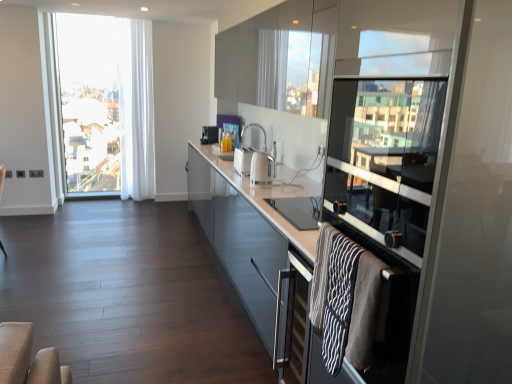
Based on the photo, measure the distance between transparent glass screen door at right and camera.

The depth of transparent glass screen door at right is 35.72 inches.

This screenshot has height=384, width=512. I want to click on white glossy toaster at center, marked as the second appliance in a back-to-front arrangement, so click(x=243, y=160).

What do you see at coordinates (243, 160) in the screenshot? I see `white glossy toaster at center, the second appliance when ordered from bottom to top` at bounding box center [243, 160].

This screenshot has width=512, height=384. What do you see at coordinates (106, 103) in the screenshot? I see `clear glass window at left` at bounding box center [106, 103].

The height and width of the screenshot is (384, 512). I want to click on transparent glass window screen at right, so click(x=385, y=157).

Who is smaller, glossy glass cabinet at center, positioned as the 1th cabinetry in bottom-to-top order, or glossy glass cabinets at upper center, the 1th cabinetry viewed from the top?

With smaller size is glossy glass cabinets at upper center, the 1th cabinetry viewed from the top.

Which is more to the right, glossy glass cabinet at center, the second cabinetry from the top, or glossy glass cabinets at upper center, the 1th cabinetry viewed from the top?

glossy glass cabinets at upper center, the 1th cabinetry viewed from the top, is more to the right.

From the image's perspective, does glossy glass cabinet at center, positioned as the 1th cabinetry in bottom-to-top order, appear higher than glossy glass cabinets at upper center, the 1th cabinetry viewed from the top?

No, from the image's perspective, glossy glass cabinet at center, positioned as the 1th cabinetry in bottom-to-top order, is not above glossy glass cabinets at upper center, the 1th cabinetry viewed from the top.

Is glossy glass cabinet at center, the second cabinetry from the top, aimed at glossy glass cabinets at upper center, the 1th cabinetry viewed from the top?

No.

Identify the location of appliance that is the 3rd one when counting forward from the clear glass window at left. (262, 169).

Which object is further away from the camera taking this photo, clear glass window at left or white glossy electric kettle at center, placed as the 1th appliance when sorted from bottom to top?

clear glass window at left is further from the camera.

In the scene shown: Which of these two, clear glass window at left or white glossy electric kettle at center, the 1th appliance from the front, is wider?

With larger width is clear glass window at left.

Is clear glass window at left facing away from white glossy electric kettle at center, arranged as the 3th appliance when viewed from the top?

No, clear glass window at left is not facing the opposite direction of white glossy electric kettle at center, arranged as the 3th appliance when viewed from the top.

Does point (104, 27) come behind point (240, 163)?

Yes, point (104, 27) is farther from viewer.

Measure the distance between clear glass window at left and white glossy toaster at center, marked as the second appliance in a back-to-front arrangement.

A distance of 8.05 feet exists between clear glass window at left and white glossy toaster at center, marked as the second appliance in a back-to-front arrangement.

From the image's perspective, which is below, clear glass window at left or white glossy toaster at center, placed as the 2th appliance when sorted from top to bottom?

white glossy toaster at center, placed as the 2th appliance when sorted from top to bottom, is shown below in the image.

From a real-world perspective, is clear glass window at left above or below white glossy toaster at center, marked as the second appliance in a left-to-right arrangement?

clear glass window at left is situated higher than white glossy toaster at center, marked as the second appliance in a left-to-right arrangement, in the real world.

Considering the relative positions of white glossy electric kettle at center, arranged as the 3th appliance when viewed from the top, and transparent glass window screen at right in the image provided, is white glossy electric kettle at center, arranged as the 3th appliance when viewed from the top, to the left of transparent glass window screen at right from the viewer's perspective?

Yes, white glossy electric kettle at center, arranged as the 3th appliance when viewed from the top, is to the left of transparent glass window screen at right.

From the image's perspective, which one is positioned lower, white glossy electric kettle at center, arranged as the 3th appliance when viewed from the top, or transparent glass window screen at right?

white glossy electric kettle at center, arranged as the 3th appliance when viewed from the top, is shown below in the image.

Which is closer to the camera, [260,161] or [340,102]?

Positioned in front is point [340,102].

Is white glossy electric kettle at center, arranged as the 3th appliance when viewed from the top, positioned with its back to transparent glass window screen at right?

That's not correct — white glossy electric kettle at center, arranged as the 3th appliance when viewed from the top, is not looking away from transparent glass window screen at right.

Is white glossy toaster at center, marked as the second appliance in a back-to-front arrangement, wider than glossy glass cabinets at upper center, the 1th cabinetry viewed from the top?

In fact, white glossy toaster at center, marked as the second appliance in a back-to-front arrangement, might be narrower than glossy glass cabinets at upper center, the 1th cabinetry viewed from the top.

From a real-world perspective, is white glossy toaster at center, placed as the 2th appliance when sorted from top to bottom, above or below glossy glass cabinets at upper center, the 1th cabinetry viewed from the top?

In terms of real-world spatial position, white glossy toaster at center, placed as the 2th appliance when sorted from top to bottom, is below glossy glass cabinets at upper center, the 1th cabinetry viewed from the top.

Is white glossy toaster at center, acting as the 2th appliance starting from the front, taller than glossy glass cabinets at upper center, the 1th cabinetry viewed from the top?

No, white glossy toaster at center, acting as the 2th appliance starting from the front, is not taller than glossy glass cabinets at upper center, the 1th cabinetry viewed from the top.

Which is correct: white glossy toaster at center, the second appliance when ordered from bottom to top, is inside glossy glass cabinets at upper center, the 1th cabinetry viewed from the top, or outside of it?

white glossy toaster at center, the second appliance when ordered from bottom to top, cannot be found inside glossy glass cabinets at upper center, the 1th cabinetry viewed from the top.

How different are the orientations of glossy glass cabinets at upper center, which is the 2th cabinetry in bottom-to-top order, and transparent glass screen door at right in degrees?

→ 0.779 degrees separate the facing orientations of glossy glass cabinets at upper center, which is the 2th cabinetry in bottom-to-top order, and transparent glass screen door at right.

Is there a large distance between glossy glass cabinets at upper center, which is the 2th cabinetry in bottom-to-top order, and transparent glass screen door at right?

glossy glass cabinets at upper center, which is the 2th cabinetry in bottom-to-top order, is near transparent glass screen door at right, not far away.

Is glossy glass cabinets at upper center, the 1th cabinetry viewed from the top, facing away from transparent glass screen door at right?

glossy glass cabinets at upper center, the 1th cabinetry viewed from the top, is not turned away from transparent glass screen door at right.

In the image, is glossy glass cabinets at upper center, the 1th cabinetry viewed from the top, positioned in front of or behind transparent glass screen door at right?

glossy glass cabinets at upper center, the 1th cabinetry viewed from the top, is positioned farther from the viewer than transparent glass screen door at right.

Considering the positions of objects white sheer curtain at left and white glossy toaster at center, marked as the second appliance in a left-to-right arrangement, in the image provided, who is more to the left, white sheer curtain at left or white glossy toaster at center, marked as the second appliance in a left-to-right arrangement,?

Positioned to the left is white sheer curtain at left.

Would you say white glossy toaster at center, marked as the second appliance in a back-to-front arrangement, is part of white sheer curtain at left's contents?

No, white glossy toaster at center, marked as the second appliance in a back-to-front arrangement, is located outside of white sheer curtain at left.

From a real-world perspective, is white sheer curtain at left above or below white glossy toaster at center, the second appliance when ordered from bottom to top?

Clearly, from a real-world perspective, white sheer curtain at left is above white glossy toaster at center, the second appliance when ordered from bottom to top.

Can you tell me how much white sheer curtain at left and white glossy toaster at center, marked as the second appliance in a back-to-front arrangement, differ in facing direction?

There is a 89.7-degree angle between the facing directions of white sheer curtain at left and white glossy toaster at center, marked as the second appliance in a back-to-front arrangement.

Identify the location of cabinetry on the right of glossy glass cabinet at center, the second cabinetry from the top. The width and height of the screenshot is (512, 384). (280, 58).

This screenshot has height=384, width=512. Find the location of `window behind the white glossy electric kettle at center, the 1th appliance from the front`. window behind the white glossy electric kettle at center, the 1th appliance from the front is located at coordinates (106, 103).

Considering their positions, is clear glass window at left positioned closer to satin silver toaster at center, the 3th appliance ordered from the bottom, than transparent glass screen door at right?

The object closer to satin silver toaster at center, the 3th appliance ordered from the bottom, is clear glass window at left.

Looking at the image, which one is located further to clear glass window at left, white glossy electric kettle at center, the 1th appliance viewed from the right, or white glossy toaster at center, placed as the 2th appliance when sorted from top to bottom?

Based on the image, white glossy electric kettle at center, the 1th appliance viewed from the right, appears to be further to clear glass window at left.

Estimate the real-world distances between objects in this image. Which object is closer to white sheer curtain at left, transparent glass window screen at right or glossy glass cabinets at upper center, the 1th cabinetry viewed from the top?

Based on the image, glossy glass cabinets at upper center, the 1th cabinetry viewed from the top, appears to be nearer to white sheer curtain at left.

Based on their spatial positions, is white glossy electric kettle at center, the 1th appliance viewed from the right, or white sheer curtain at left further from glossy glass cabinets at upper center, the 1th cabinetry viewed from the top?

white sheer curtain at left is further to glossy glass cabinets at upper center, the 1th cabinetry viewed from the top.

Estimate the real-world distances between objects in this image. Which object is closer to transparent glass screen door at right, transparent glass window screen at right or white glossy electric kettle at center, placed as the 1th appliance when sorted from bottom to top?

transparent glass window screen at right is closer to transparent glass screen door at right.

Looking at the image, which one is located further to clear glass window at left, transparent glass screen door at right or glossy glass cabinet at center, positioned as the 1th cabinetry in bottom-to-top order?

transparent glass screen door at right is further to clear glass window at left.

Looking at the image, which one is located closer to transparent glass window screen at right, clear glass window at left or glossy glass cabinet at center, positioned as the 1th cabinetry in bottom-to-top order?

Among the two, glossy glass cabinet at center, positioned as the 1th cabinetry in bottom-to-top order, is located nearer to transparent glass window screen at right.

Looking at the image, which one is located further to satin silver toaster at center, arranged as the 3th appliance when viewed from the right, transparent glass screen door at right or white glossy electric kettle at center, arranged as the 3th appliance when viewed from the top?

transparent glass screen door at right lies further to satin silver toaster at center, arranged as the 3th appliance when viewed from the right, than the other object.

I want to click on curtain between transparent glass screen door at right and clear glass window at left in the front-back direction, so click(x=142, y=111).

Locate an element on the screen. window screen positioned between transparent glass screen door at right and clear glass window at left from near to far is located at coordinates (385, 157).

At what (x,y) coordinates should I click in order to perform the action: click on window screen between transparent glass screen door at right and white sheer curtain at left along the z-axis. Please return your answer as a coordinate pair (x, y). The width and height of the screenshot is (512, 384). Looking at the image, I should click on (385, 157).

The image size is (512, 384). In order to click on window screen located between transparent glass screen door at right and glossy glass cabinet at center, the second cabinetry from the top, in the depth direction in this screenshot , I will do `click(385, 157)`.